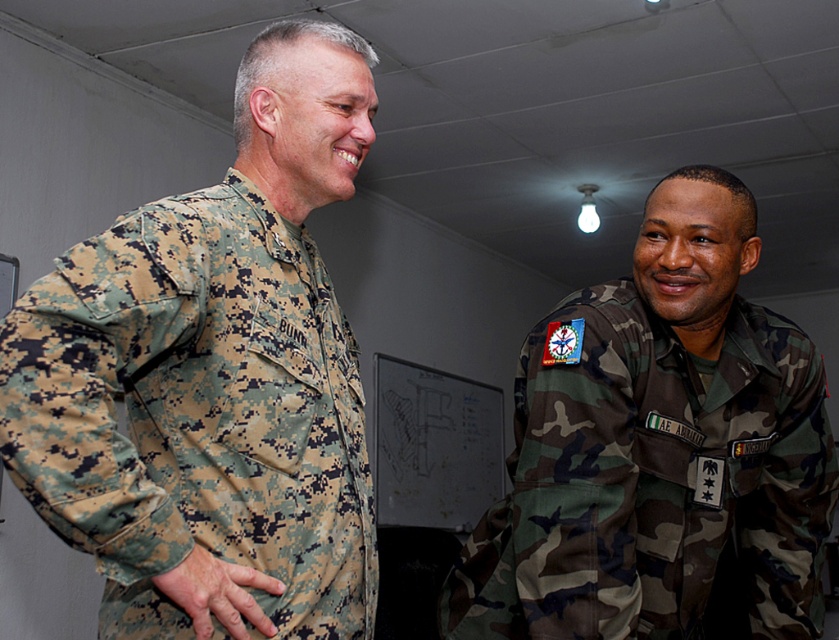
Is digital camouflage uniform at left further to the viewer compared to camo uniform at right?

No.

Can you confirm if digital camouflage uniform at left is positioned above camo uniform at right?

Correct, digital camouflage uniform at left is located above camo uniform at right.

At what (x,y) coordinates should I click in order to perform the action: click on digital camouflage uniform at left. Please return your answer as a coordinate pair (x, y). The image size is (839, 640). Looking at the image, I should click on (212, 378).

Locate an element on the screen. The image size is (839, 640). digital camouflage uniform at left is located at coordinates (212, 378).